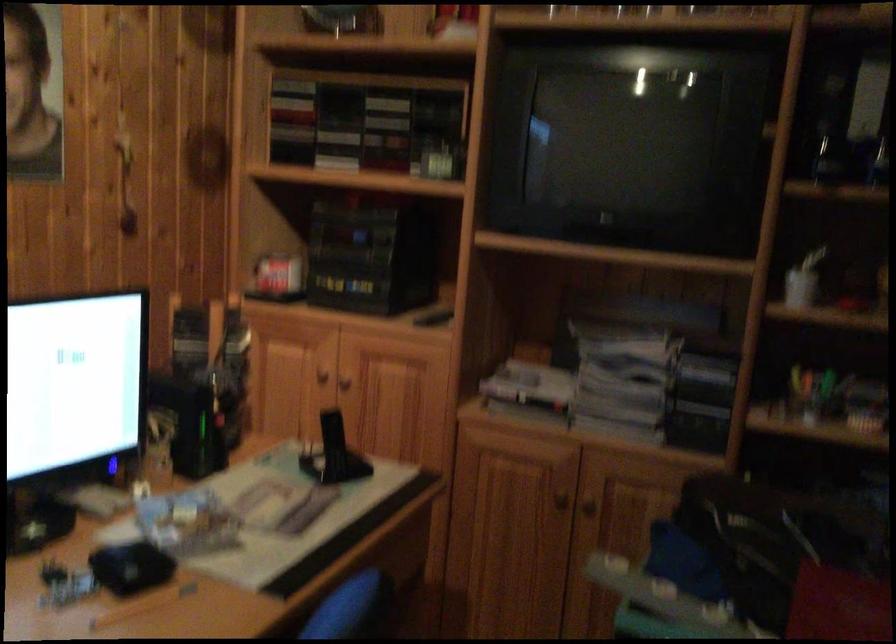
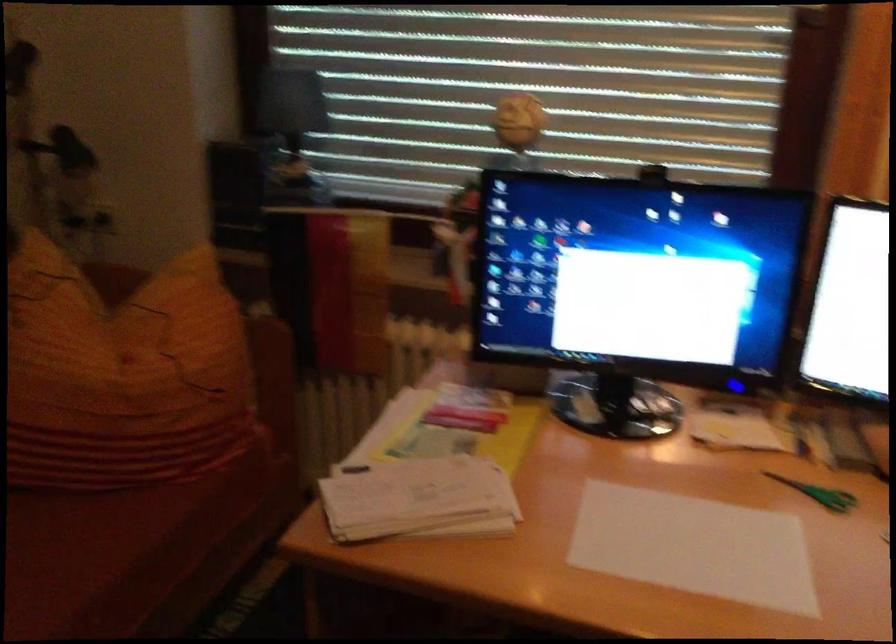
The first image is from the beginning of the video and the second image is from the end. How did the camera likely rotate when shooting the video?

The camera rotated toward left-down.